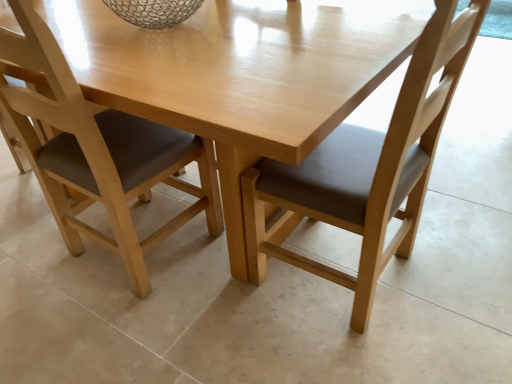
Question: Does matte wood chair at center, the second chair positioned from the left, have a lesser width compared to light wood table at center?

Choices:
 (A) yes
 (B) no

Answer: (A)

Question: Considering the relative positions of matte wood chair at center, the second chair positioned from the left, and light wood table at center in the image provided, is matte wood chair at center, the second chair positioned from the left, to the right of light wood table at center from the viewer's perspective?

Choices:
 (A) yes
 (B) no

Answer: (A)

Question: Is matte wood chair at center, the 1th chair from the right, not close to light wood table at center?

Choices:
 (A) yes
 (B) no

Answer: (B)

Question: Considering the relative sizes of matte wood chair at center, the 1th chair from the right, and light wood table at center in the image provided, is matte wood chair at center, the 1th chair from the right, smaller than light wood table at center?

Choices:
 (A) yes
 (B) no

Answer: (A)

Question: Is light wood table at center inside matte wood chair at center, the 1th chair from the right?

Choices:
 (A) yes
 (B) no

Answer: (B)

Question: Is matte wood chair at center, the second chair positioned from the left, to the left of light wood table at center from the viewer's perspective?

Choices:
 (A) yes
 (B) no

Answer: (B)

Question: Would you say light wood table at center is part of matte wood chair at lower left, the first chair from the left,'s contents?

Choices:
 (A) yes
 (B) no

Answer: (B)

Question: Is matte wood chair at lower left, positioned as the 2th chair in right-to-left order, bigger than light wood table at center?

Choices:
 (A) no
 (B) yes

Answer: (A)

Question: From a real-world perspective, is matte wood chair at lower left, the first chair from the left, positioned over light wood table at center based on gravity?

Choices:
 (A) no
 (B) yes

Answer: (B)

Question: From a real-world perspective, is matte wood chair at lower left, positioned as the 2th chair in right-to-left order, below light wood table at center?

Choices:
 (A) yes
 (B) no

Answer: (B)

Question: Can you confirm if matte wood chair at lower left, positioned as the 2th chair in right-to-left order, is smaller than light wood table at center?

Choices:
 (A) no
 (B) yes

Answer: (B)

Question: Is matte wood chair at lower left, the first chair from the left, next to light wood table at center?

Choices:
 (A) yes
 (B) no

Answer: (B)

Question: Can you confirm if matte wood chair at center, the second chair positioned from the left, is taller than matte wood chair at lower left, the first chair from the left?

Choices:
 (A) no
 (B) yes

Answer: (B)